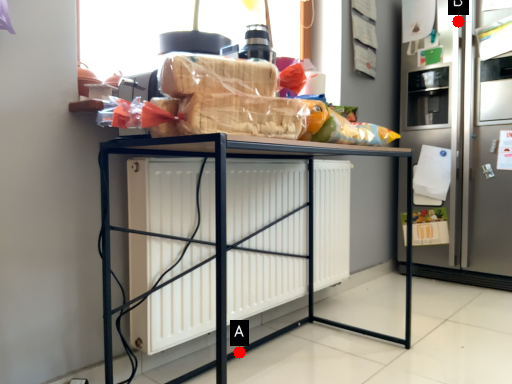
Question: Two points are circled on the image, labeled by A and B beside each circle. Which point is closer to the camera taking this photo?

Choices:
 (A) A is closer
 (B) B is closer

Answer: (A)